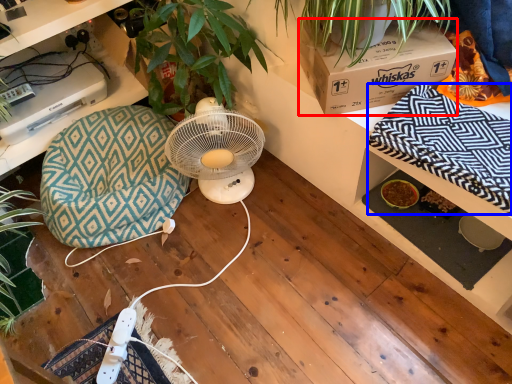
Question: Which of the following is the closest to the observer, box (highlighted by a red box) or blanket (highlighted by a blue box)?

Choices:
 (A) box
 (B) blanket

Answer: (B)